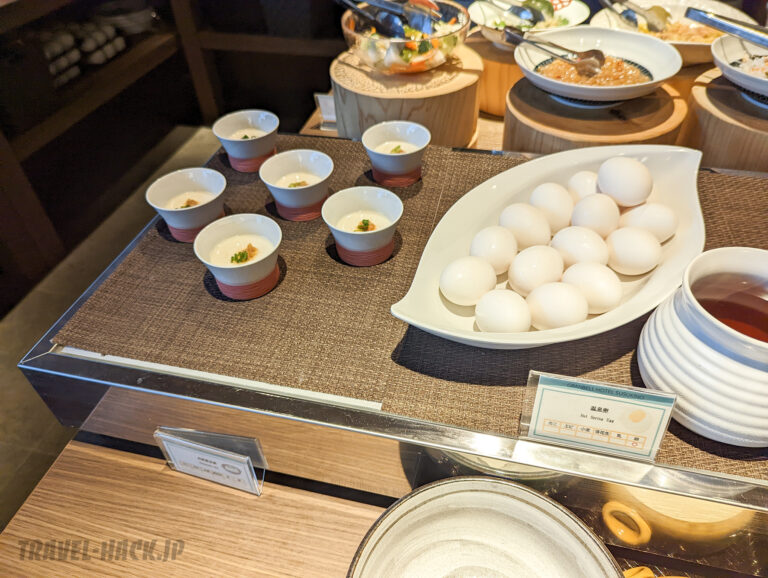
This screenshot has height=578, width=768. In order to click on wooden shelf in this screenshot , I will do `click(53, 125)`.